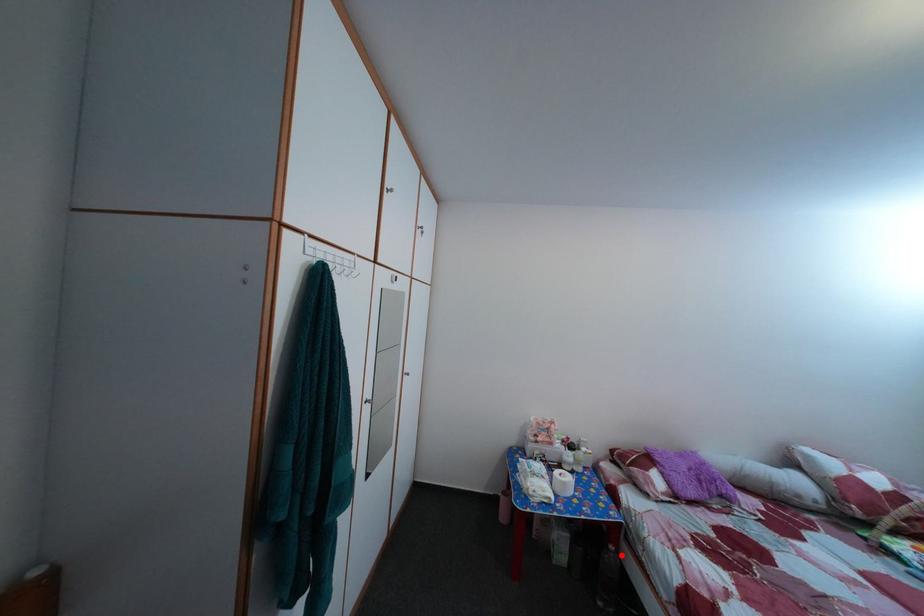
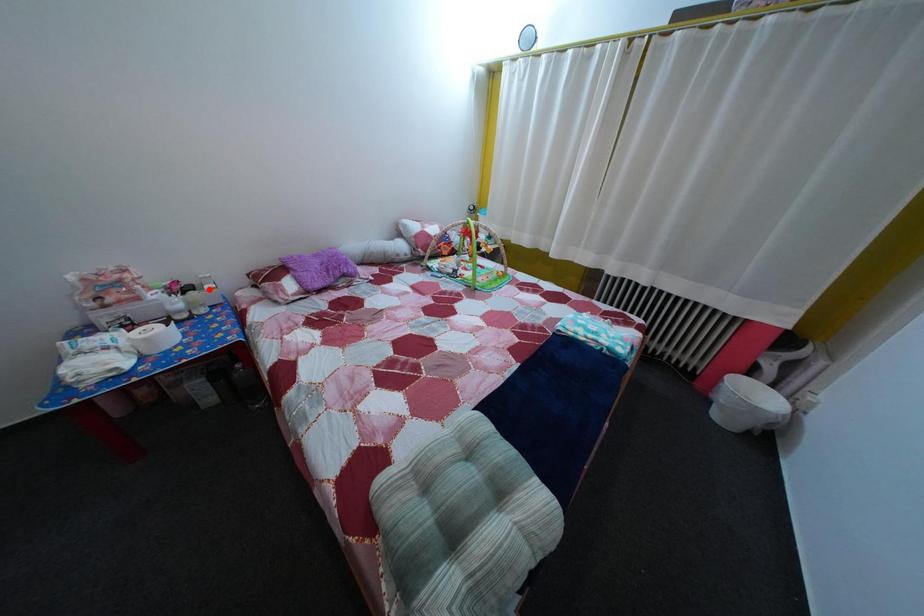
I am providing you with two images of the same scene from different viewpoints. A red point is marked on the first image and another point is marked on the second image. Are the points marked in image1 and image2 representing the same 3D position?

No